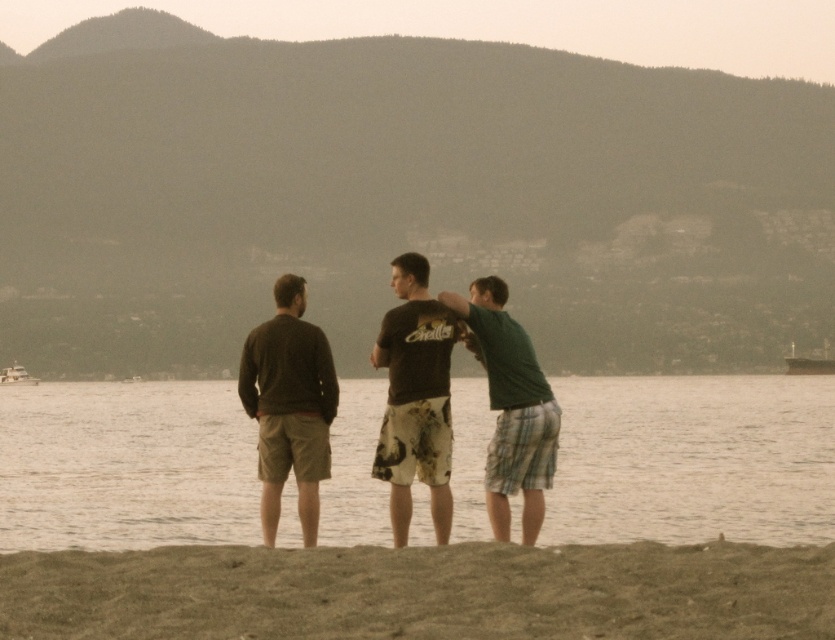
Question: Does dark brown sweater at center come behind green plaid shorts at center?

Choices:
 (A) yes
 (B) no

Answer: (B)

Question: Does smooth water at center appear under brown sandy beach at lower center?

Choices:
 (A) yes
 (B) no

Answer: (A)

Question: Which of these objects is positioned farthest from the smooth water at center?

Choices:
 (A) green plaid shorts at center
 (B) dark brown sweater at center
 (C) dark brown cotton t-shirt at center

Answer: (C)

Question: Which object appears closest to the camera in this image?

Choices:
 (A) dark brown cotton t-shirt at center
 (B) dark brown sweater at center
 (C) smooth water at center

Answer: (A)

Question: Can you confirm if smooth water at center is bigger than brown sandy beach at lower center?

Choices:
 (A) no
 (B) yes

Answer: (B)

Question: Which of the following is the farthest from the observer?

Choices:
 (A) (269, 445)
 (B) (537, 492)

Answer: (A)